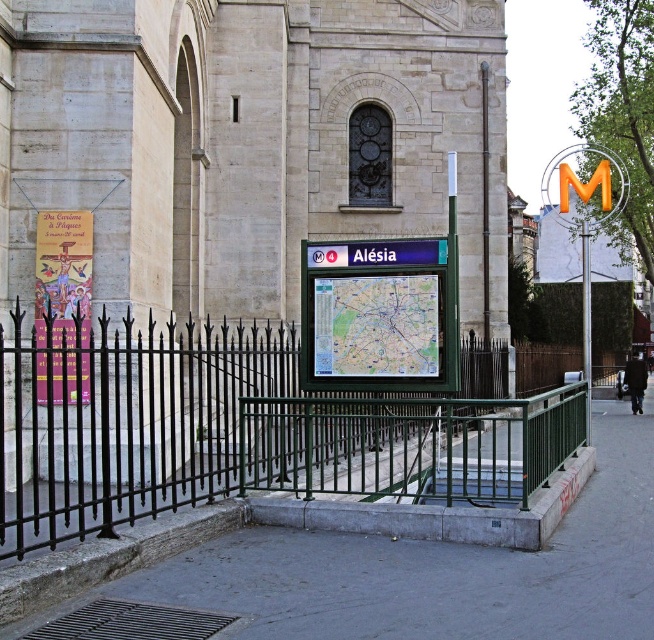
Does beige stone church at center appear on the right side of paper map at center?

In fact, beige stone church at center is to the left of paper map at center.

Which of these two, beige stone church at center or paper map at center, stands shorter?

paper map at center

Locate an element on the screen. The image size is (654, 640). beige stone church at center is located at coordinates (247, 141).

Find the location of `beige stone church at center`. beige stone church at center is located at coordinates (247, 141).

Which of these two, beige stone church at center or gray concrete pavement at center, stands shorter?

With less height is gray concrete pavement at center.

Is beige stone church at center shorter than gray concrete pavement at center?

In fact, beige stone church at center may be taller than gray concrete pavement at center.

Who is more distant from viewer, (22, 38) or (54, 561)?

Positioned behind is point (22, 38).

The height and width of the screenshot is (640, 654). In order to click on beige stone church at center in this screenshot , I will do `click(247, 141)`.

Is gray concrete pavement at center wider than paper map at center?

Indeed, gray concrete pavement at center has a greater width compared to paper map at center.

Does gray concrete pavement at center appear under paper map at center?

Yes, gray concrete pavement at center is below paper map at center.

What do you see at coordinates (436, 570) in the screenshot? This screenshot has height=640, width=654. I see `gray concrete pavement at center` at bounding box center [436, 570].

This screenshot has width=654, height=640. I want to click on gray concrete pavement at center, so click(x=436, y=570).